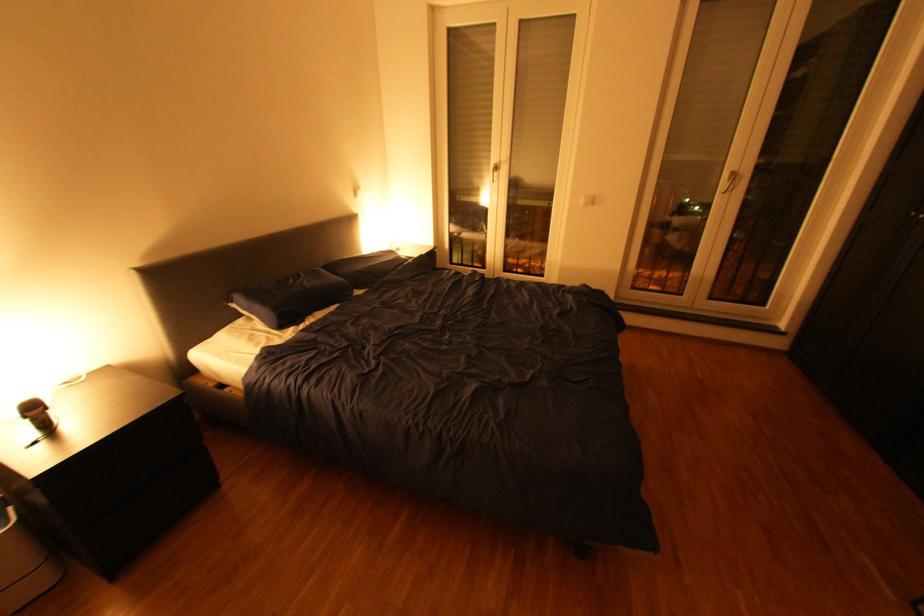
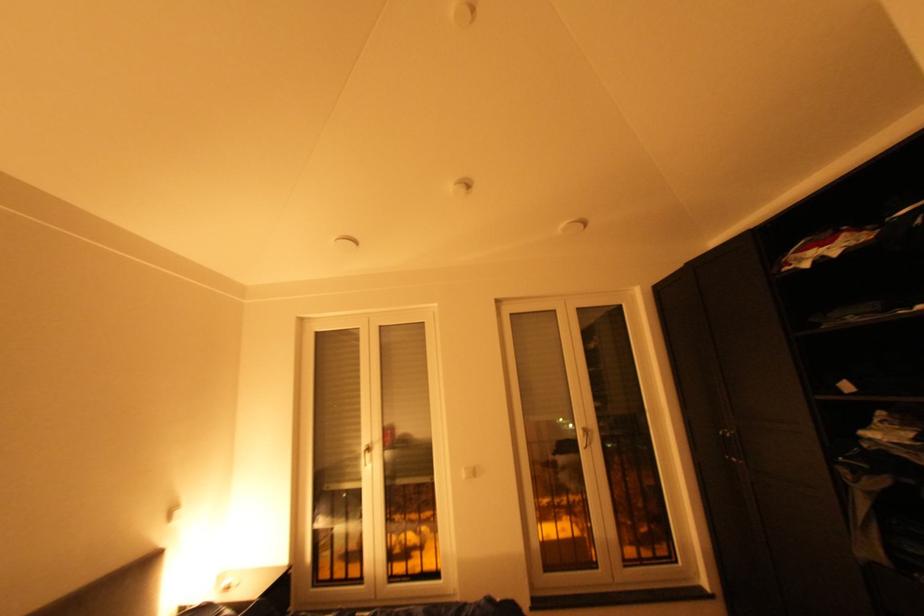
Locate, in the second image, the point that corresponds to (591,201) in the first image.

(473, 476)